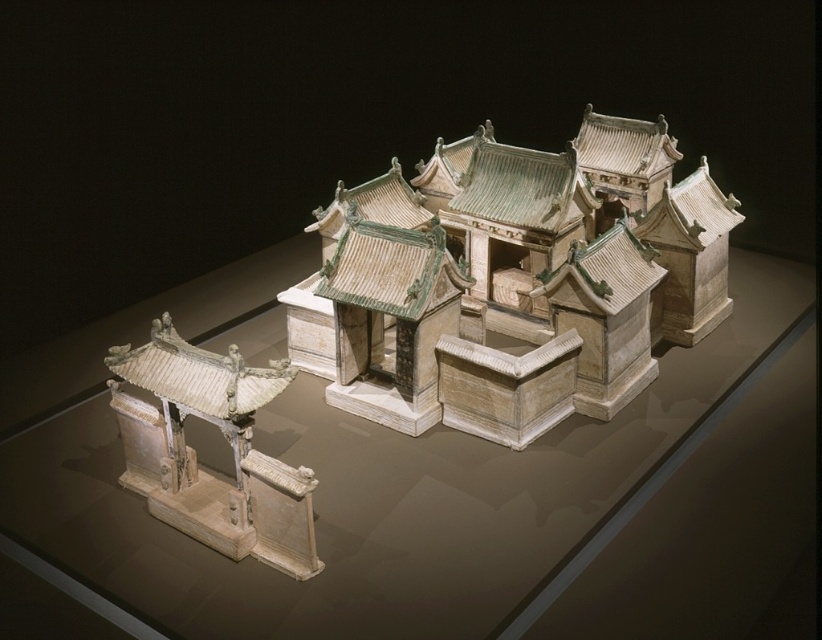
Can you confirm if transparent glass table at center is wider than white ceramic gate at lower left?

Correct, the width of transparent glass table at center exceeds that of white ceramic gate at lower left.

Does transparent glass table at center have a larger size compared to white ceramic gate at lower left?

Yes.

Where is `transparent glass table at center`? transparent glass table at center is located at coordinates (359, 481).

Based on the photo, is transparent glass table at center positioned behind white stone building at center?

That is False.

Is transparent glass table at center below white stone building at center?

Correct, transparent glass table at center is located below white stone building at center.

Who is more distant from viewer, (x=432, y=586) or (x=603, y=248)?

Point (x=603, y=248)

In order to click on transparent glass table at center in this screenshot , I will do click(x=359, y=481).

Is white stone building at center bigger than white ceramic gate at lower left?

Yes.

Between point (293, 326) and point (238, 392), which one is positioned behind?

The point (293, 326) is more distant.

Is point (589, 317) farther from camera compared to point (273, 518)?

Yes.

Image resolution: width=822 pixels, height=640 pixels. I want to click on white stone building at center, so click(523, 285).